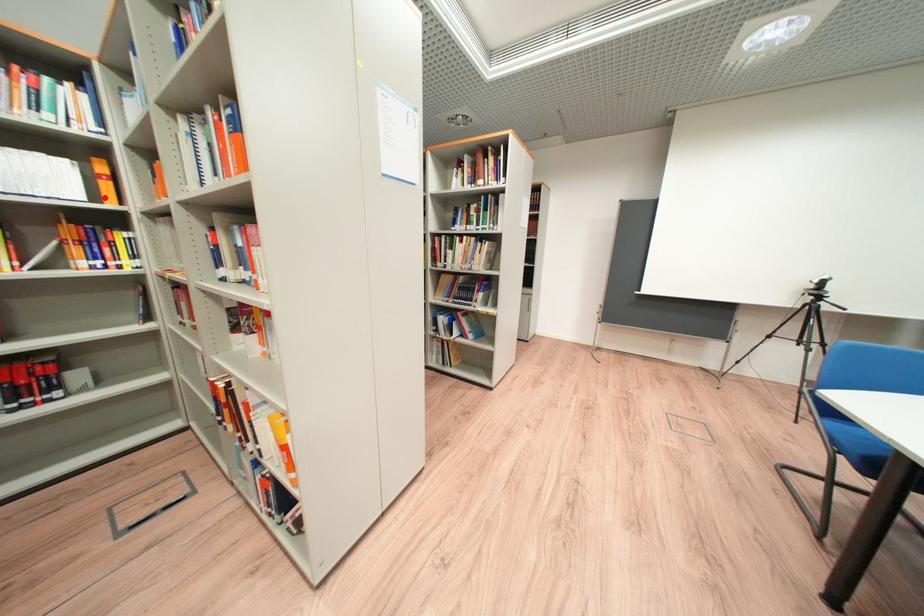
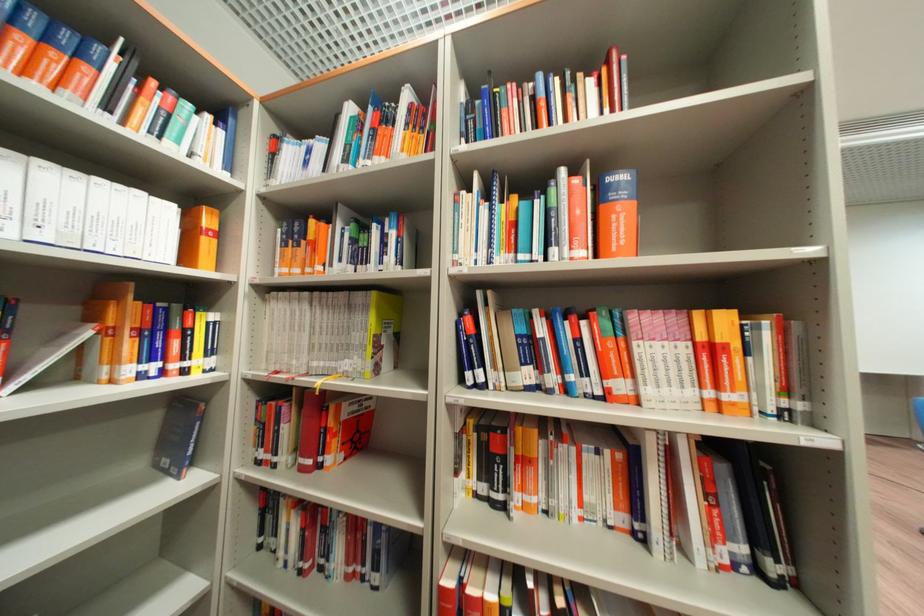
Locate, in the second image, the point that corresponds to the highlighted location in the first image.

(198, 260)